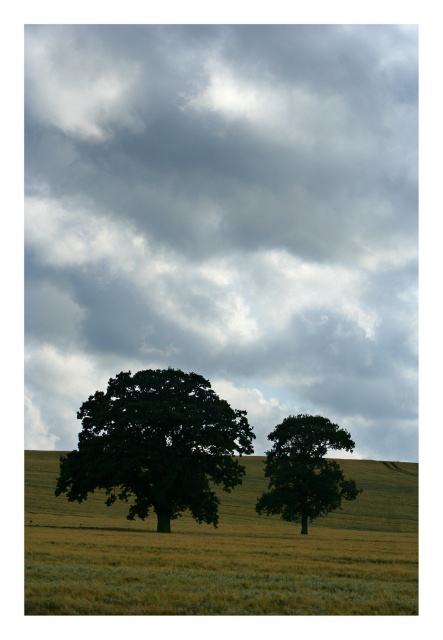
Question: Which is farther from the cloudy gray sky at upper center?

Choices:
 (A) green leafy oak at center
 (B) green leafy tree at center

Answer: (B)

Question: Estimate the real-world distances between objects in this image. Which object is farther from the green leafy oak at center?

Choices:
 (A) cloudy gray sky at upper center
 (B) green leafy tree at center

Answer: (A)

Question: Does cloudy gray sky at upper center appear under green leafy oak at center?

Choices:
 (A) yes
 (B) no

Answer: (B)

Question: Is cloudy gray sky at upper center closer to the viewer compared to green leafy tree at center?

Choices:
 (A) yes
 (B) no

Answer: (A)

Question: Among these objects, which one is nearest to the camera?

Choices:
 (A) green leafy oak at center
 (B) green leafy tree at center

Answer: (A)

Question: Observing the image, what is the correct spatial positioning of cloudy gray sky at upper center in reference to green leafy oak at center?

Choices:
 (A) right
 (B) left

Answer: (B)